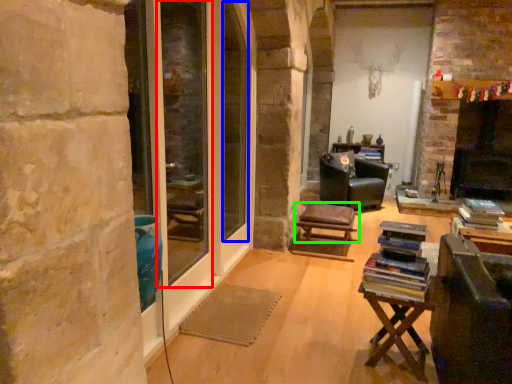
Question: Considering the real-world distances, which object is closest to screen door (highlighted by a red box)? window screen (highlighted by a blue box) or stool (highlighted by a green box).

Choices:
 (A) window screen
 (B) stool

Answer: (A)